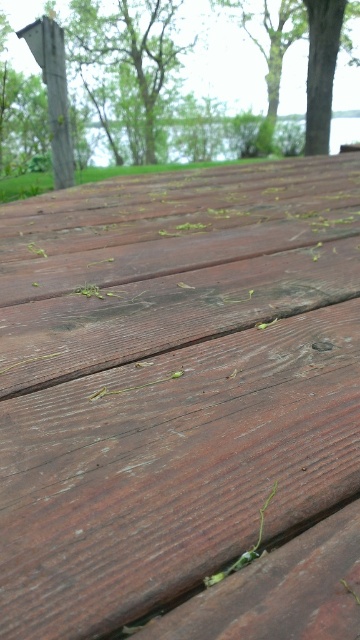
Is dark brown wood at center above green leafy tree at upper center?

No.

Who is shorter, dark brown wood at center or green leafy tree at upper center?

dark brown wood at center

Is point (38, 365) positioned after point (273, 112)?

That is False.

Where is `dark brown wood at center`? This screenshot has height=640, width=360. dark brown wood at center is located at coordinates (167, 312).

In the scene shown: Does dark brown wood at center appear on the right side of smooth gray post at upper left?

Incorrect, dark brown wood at center is not on the right side of smooth gray post at upper left.

Which of these two, dark brown wood at center or smooth gray post at upper left, stands shorter?

With less height is dark brown wood at center.

Locate an element on the screen. dark brown wood at center is located at coordinates (167, 312).

Can you confirm if smooth gray post at upper left is shorter than green leafy tree at upper center?

Yes, smooth gray post at upper left is shorter than green leafy tree at upper center.

Describe the element at coordinates (222, 58) in the screenshot. I see `smooth gray post at upper left` at that location.

Locate an element on the screen. Image resolution: width=360 pixels, height=640 pixels. smooth gray post at upper left is located at coordinates (222, 58).

I want to click on smooth gray post at upper left, so click(x=222, y=58).